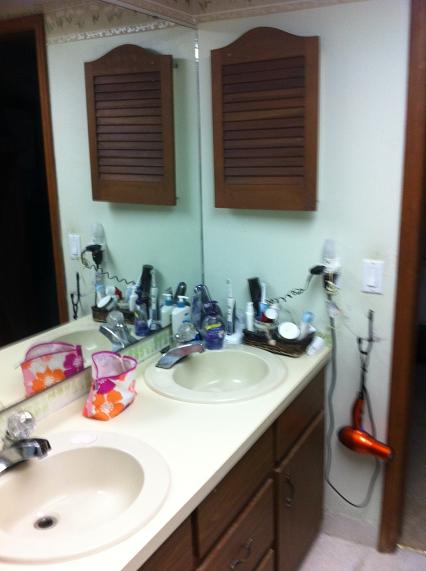
In order to click on left porcelain sink in this screenshot , I will do `click(67, 482)`.